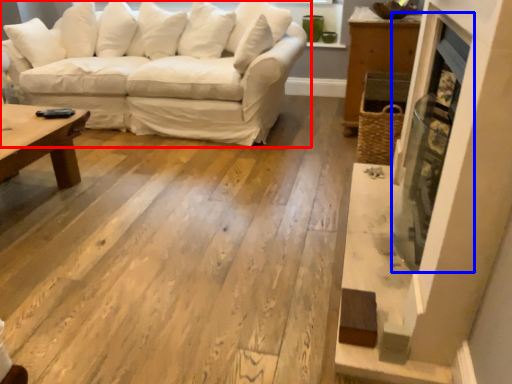
Question: Which point is closer to the camera, studio couch (highlighted by a red box) or fireplace (highlighted by a blue box)?

Choices:
 (A) studio couch
 (B) fireplace

Answer: (B)